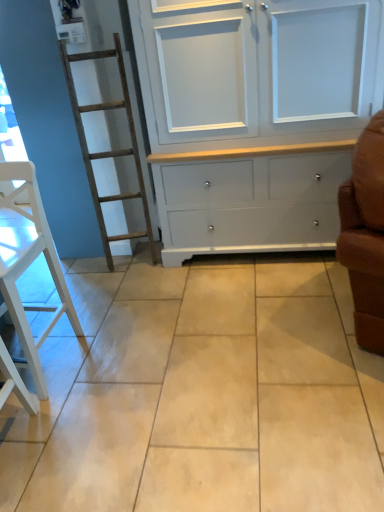
Question: Visually, is beige ceramic tile at center positioned to the left or to the right of white wood chair at left?

Choices:
 (A) left
 (B) right

Answer: (B)

Question: Do you think beige ceramic tile at center is within white wood chair at left, or outside of it?

Choices:
 (A) outside
 (B) inside

Answer: (A)

Question: Which is farther from the white wood chair at left?

Choices:
 (A) beige ceramic tile at center
 (B) white painted wood cupboard at center

Answer: (B)

Question: Based on their relative distances, which object is nearer to the white painted wood cupboard at center?

Choices:
 (A) white wood chair at left
 (B) beige ceramic tile at center

Answer: (B)